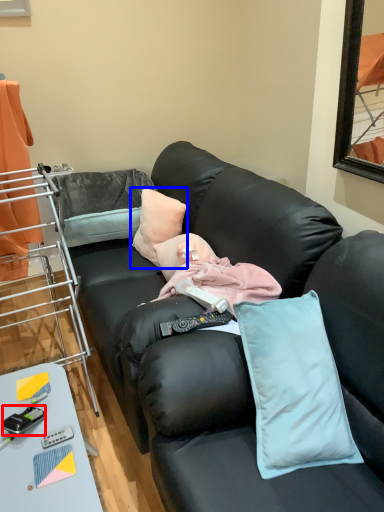
Question: Among these objects, which one is farthest to the camera, equipment (highlighted by a red box) or pillow (highlighted by a blue box)?

Choices:
 (A) equipment
 (B) pillow

Answer: (B)